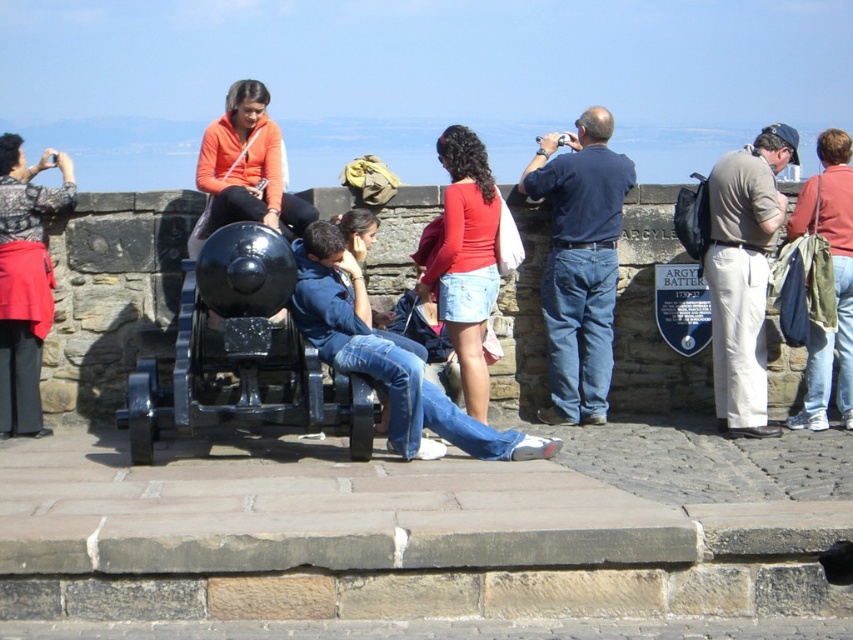
Between matte black camera at left and denim shorts at center, which one appears on the left side from the viewer's perspective?

matte black camera at left

Who is more distant from viewer, (x=0, y=326) or (x=456, y=348)?

The point (x=0, y=326) is more distant.

Who is more distant from viewer, (36,422) or (474,209)?

The point (36,422) is behind.

Identify the location of matte black camera at left. The image size is (853, 640). (25, 280).

Between khaki cotton pants at right and denim jeans at right, which one is positioned lower?

Positioned lower is khaki cotton pants at right.

Where is `khaki cotton pants at right`? Image resolution: width=853 pixels, height=640 pixels. khaki cotton pants at right is located at coordinates (744, 275).

Is khaki cotton pants at right above denim shorts at center?

Actually, khaki cotton pants at right is below denim shorts at center.

Is point (735, 221) positioned after point (480, 160)?

No, it is in front of (480, 160).

At what (x,y) coordinates should I click in order to perform the action: click on khaki cotton pants at right. Please return your answer as a coordinate pair (x, y). Image resolution: width=853 pixels, height=640 pixels. Looking at the image, I should click on (744, 275).